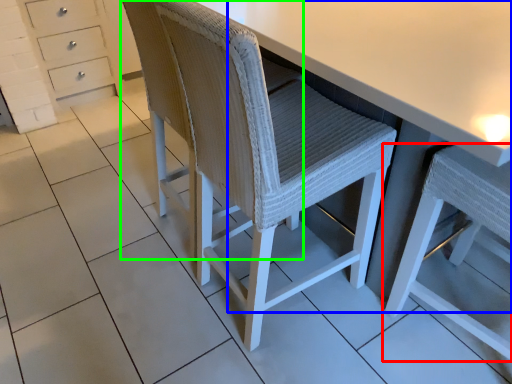
Question: Based on their relative distances, which object is farther from chair (highlighted by a red box)? Choose from table (highlighted by a blue box) and swivel chair (highlighted by a green box).

Choices:
 (A) table
 (B) swivel chair

Answer: (B)